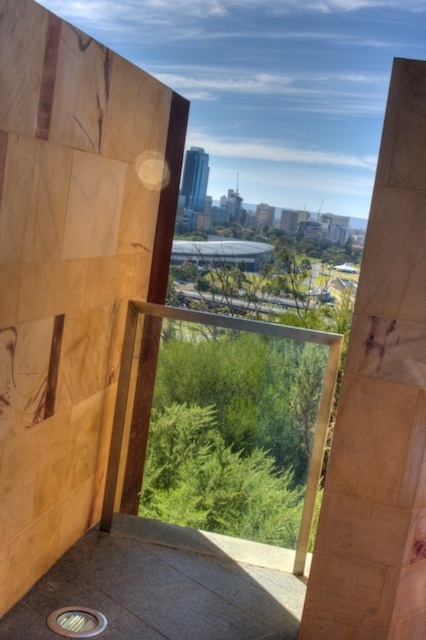
You are standing at the point with coordinates closest to the bottom left corner of the image. You want to walk towards the glass railing in the center and then proceed to the point marked as point (80, 634). Will you pass by point (406, 538) on your way?

Yes, you will pass by point (406, 538) on your way to point (80, 634) because point (406, 538) is in front of point (80, 634).